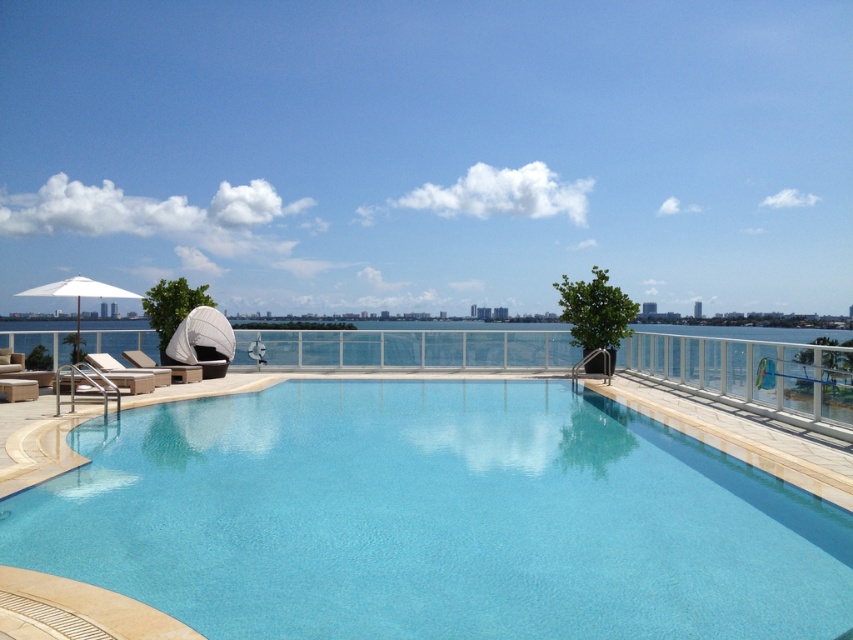
Question: Does clear glass swimming pool at center appear over white fabric umbrella at upper left?

Choices:
 (A) no
 (B) yes

Answer: (A)

Question: Does white fabric umbrella at upper left have a smaller size compared to beige fabric lounge chair at lower left?

Choices:
 (A) no
 (B) yes

Answer: (A)

Question: Which point is farther to the camera?

Choices:
 (A) white fabric umbrella at upper left
 (B) clear glass swimming pool at center

Answer: (A)

Question: Can you confirm if white fabric umbrella at upper left is thinner than white fabric lounge chair at left?

Choices:
 (A) no
 (B) yes

Answer: (A)

Question: Which point appears closest to the camera in this image?

Choices:
 (A) (132, 387)
 (B) (22, 291)
 (C) (440, 420)

Answer: (C)

Question: Among these objects, which one is nearest to the camera?

Choices:
 (A) clear glass swimming pool at center
 (B) white fabric lounge chair at left

Answer: (A)